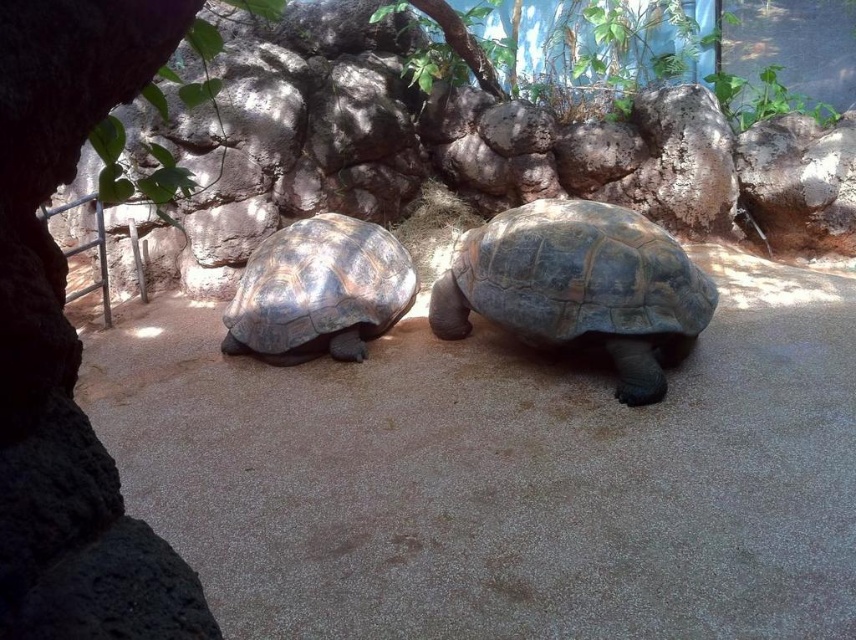
Question: Which point is closer to the camera?

Choices:
 (A) (498, 312)
 (B) (236, 330)

Answer: (A)

Question: Is rough textured tortoise at center closer to the viewer compared to dark brown textured shell at center?

Choices:
 (A) no
 (B) yes

Answer: (B)

Question: Is the position of rough textured tortoise at center less distant than that of dark brown textured shell at center?

Choices:
 (A) no
 (B) yes

Answer: (B)

Question: In this image, where is rough textured tortoise at center located relative to dark brown textured shell at center?

Choices:
 (A) below
 (B) above

Answer: (A)